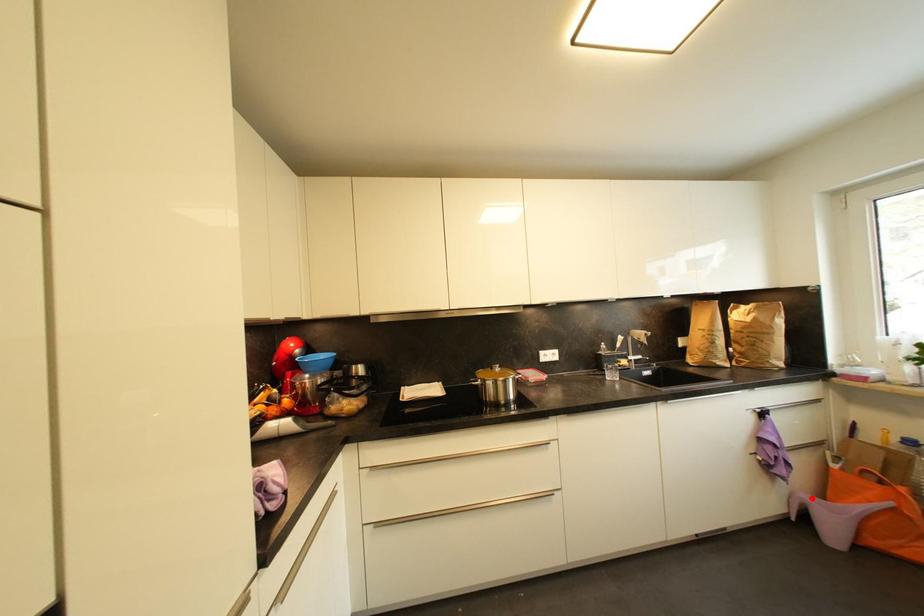
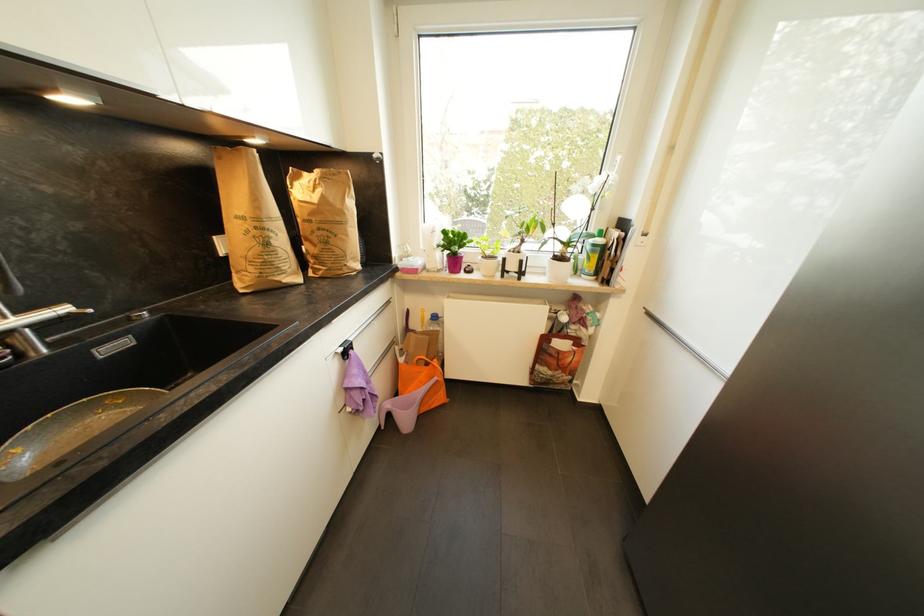
In the second image, find the point that corresponds to the highlighted location in the first image.

(393, 407)